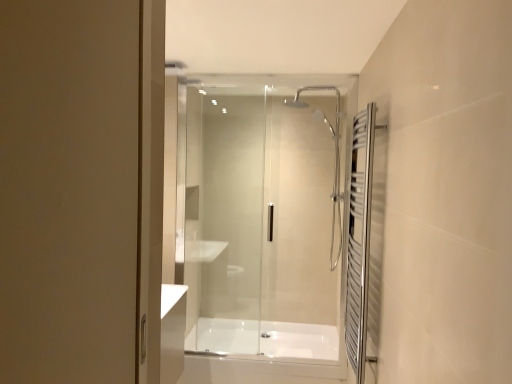
What is the approximate width of transparent glass shower door at center?

It is 2.61 inches.

You are a GUI agent. You are given a task and a screenshot of the screen. Output one action in this format:
    pyautogui.click(x=<x>, y=<y>)
    Task: Click on the transparent glass shower door at center
    The height and width of the screenshot is (384, 512).
    Given the screenshot: What is the action you would take?
    pyautogui.click(x=265, y=219)

Where is `polished chrome towel rack at right`? polished chrome towel rack at right is located at coordinates (359, 241).

Based on their sizes in the image, would you say polished chrome towel rack at right is bigger or smaller than transparent glass shower door at center?

In the image, polished chrome towel rack at right appears to be smaller than transparent glass shower door at center.

Is polished chrome towel rack at right oriented away from transparent glass shower door at center?

No, transparent glass shower door at center is not at the back of polished chrome towel rack at right.

From a real-world perspective, is polished chrome towel rack at right positioned over transparent glass shower door at center based on gravity?

Incorrect, from a real-world perspective, polished chrome towel rack at right is lower than transparent glass shower door at center.

In the scene shown: Measure the distance from polished chrome towel rack at right to transparent glass shower door at center.

1.15 meters.

Does polished chrome towel rack at right have a greater width compared to white glossy bathtub at center?

Incorrect, the width of polished chrome towel rack at right does not surpass that of white glossy bathtub at center.

Considering the relative positions of polished chrome towel rack at right and white glossy bathtub at center in the image provided, is polished chrome towel rack at right to the left of white glossy bathtub at center from the viewer's perspective?

No.

Which is less distant, (358, 122) or (327, 353)?

Point (358, 122) appears to be closer to the viewer than point (327, 353).

Considering the sizes of objects polished chrome towel rack at right and white glossy bathtub at center in the image provided, who is smaller, polished chrome towel rack at right or white glossy bathtub at center?

polished chrome towel rack at right is smaller.

From the image's perspective, between transparent glass shower door at center and polished chrome towel rack at right, who is located below?

From the image's view, polished chrome towel rack at right is below.

Is transparent glass shower door at center surrounding polished chrome towel rack at right?

No, polished chrome towel rack at right is not a part of transparent glass shower door at center.

Does transparent glass shower door at center have a greater height compared to polished chrome towel rack at right?

Indeed, transparent glass shower door at center has a greater height compared to polished chrome towel rack at right.

Is transparent glass shower door at center to the right of polished chrome towel rack at right from the viewer's perspective?

In fact, transparent glass shower door at center is to the left of polished chrome towel rack at right.

Consider the image. Is white glossy bathtub at center positioned in front of polished chrome towel rack at right?

No, white glossy bathtub at center is further to the viewer.

Is white glossy bathtub at center positioned with its back to polished chrome towel rack at right?

white glossy bathtub at center does not have its back to polished chrome towel rack at right.

Who is shorter, white glossy bathtub at center or polished chrome towel rack at right?

With less height is white glossy bathtub at center.

I want to click on glass door located above the white glossy bathtub at center (from a real-world perspective), so click(265, 219).

Considering the relative sizes of white glossy bathtub at center and transparent glass shower door at center in the image provided, is white glossy bathtub at center bigger than transparent glass shower door at center?

No.

In the scene shown: From the image's perspective, is white glossy bathtub at center located above transparent glass shower door at center?

Actually, white glossy bathtub at center appears below transparent glass shower door at center in the image.

Considering the sizes of objects white glossy bathtub at center and transparent glass shower door at center in the image provided, who is shorter, white glossy bathtub at center or transparent glass shower door at center?

white glossy bathtub at center.

Between transparent glass shower door at center and white glossy bathtub at center, which one appears on the left side from the viewer's perspective?

From the viewer's perspective, transparent glass shower door at center appears more on the left side.

Measure the distance from transparent glass shower door at center to white glossy bathtub at center.

The distance of transparent glass shower door at center from white glossy bathtub at center is 51.63 centimeters.

Which of these two, transparent glass shower door at center or white glossy bathtub at center, stands taller?

With more height is transparent glass shower door at center.

Is transparent glass shower door at center looking in the opposite direction of white glossy bathtub at center?

Absolutely, transparent glass shower door at center is directed away from white glossy bathtub at center.

Locate an element on the screen. glass door that appears on the left of polished chrome towel rack at right is located at coordinates (265, 219).

Locate an element on the screen. shower curtain above the white glossy bathtub at center (from a real-world perspective) is located at coordinates (359, 241).

Based on the photo, looking at the image, which one is located further to white glossy bathtub at center, polished chrome towel rack at right or transparent glass shower door at center?

Based on the image, polished chrome towel rack at right appears to be further to white glossy bathtub at center.

Consider the image. Based on their spatial positions, is transparent glass shower door at center or white glossy bathtub at center further from polished chrome towel rack at right?

white glossy bathtub at center is further to polished chrome towel rack at right.

Looking at the image, which one is located further to transparent glass shower door at center, white glossy bathtub at center or polished chrome towel rack at right?

polished chrome towel rack at right is positioned further to the anchor transparent glass shower door at center.

Which object lies nearer to the anchor point polished chrome towel rack at right, white glossy bathtub at center or transparent glass shower door at center?

Among the two, transparent glass shower door at center is located nearer to polished chrome towel rack at right.

Which object lies nearer to the anchor point transparent glass shower door at center, polished chrome towel rack at right or white glossy bathtub at center?

Based on the image, white glossy bathtub at center appears to be nearer to transparent glass shower door at center.

Based on their spatial positions, is transparent glass shower door at center or polished chrome towel rack at right further from white glossy bathtub at center?

Based on the image, polished chrome towel rack at right appears to be further to white glossy bathtub at center.

Find the location of a particular element. The width and height of the screenshot is (512, 384). glass door located between polished chrome towel rack at right and white glossy bathtub at center in the depth direction is located at coordinates (265, 219).